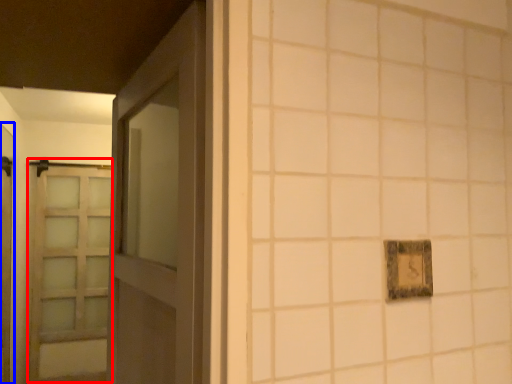
Question: Which of the following is the farthest to the observer, barn door (highlighted by a red box) or elevator (highlighted by a blue box)?

Choices:
 (A) barn door
 (B) elevator

Answer: (A)